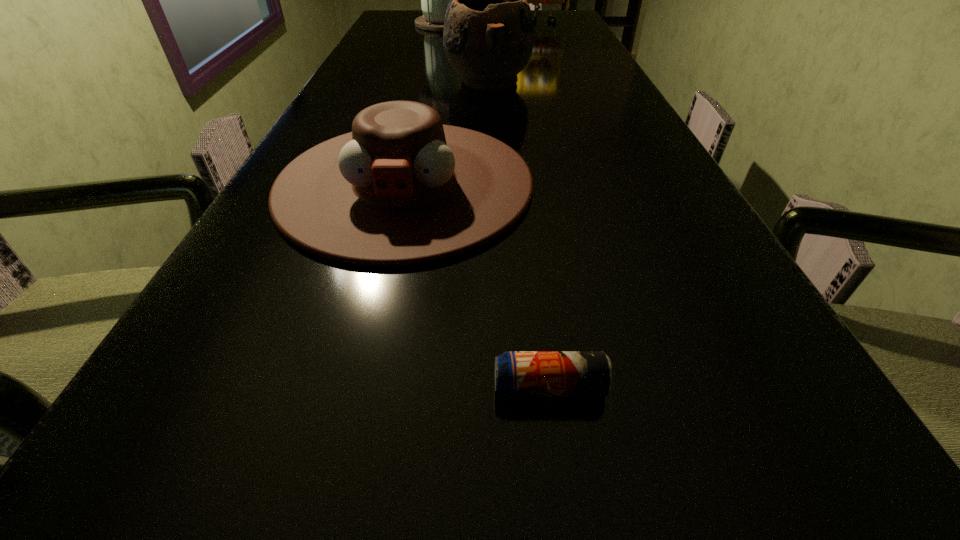
Where is `the tallest object`? This screenshot has height=540, width=960. the tallest object is located at coordinates pyautogui.click(x=434, y=0).

Where is `the second tallest object`? the second tallest object is located at coordinates (535, 0).

At what (x,y) coordinates should I click in order to perform the action: click on the third farthest object. Please return your answer as a coordinate pair (x, y). Looking at the image, I should click on (488, 36).

The image size is (960, 540). Identify the location of pottery. (488, 36).

Where is `cowboy hat`? cowboy hat is located at coordinates (402, 188).

Where is `the second shortest object`? The image size is (960, 540). the second shortest object is located at coordinates (402, 188).

Where is `beer can`? beer can is located at coordinates coord(517,373).

Find the location of `the shortest object`. the shortest object is located at coordinates pyautogui.click(x=517, y=373).

This screenshot has width=960, height=540. I want to click on vacant space situated on the right of the lantern, so click(x=553, y=24).

Locate an element on the screen. vacant space situated 0.180m on the face of the sponge is located at coordinates (550, 40).